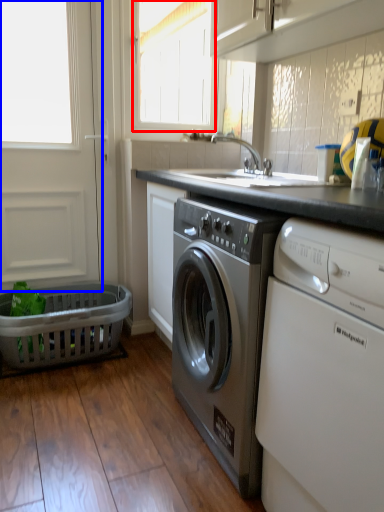
Question: Which object appears closest to the camera in this image, window (highlighted by a red box) or screen door (highlighted by a blue box)?

Choices:
 (A) window
 (B) screen door

Answer: (B)